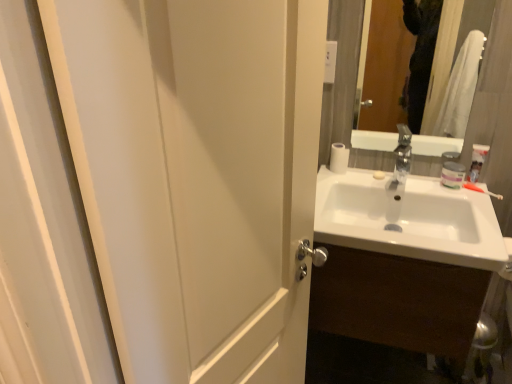
Where is `free space to the left of white matte jar at upper right`? This screenshot has height=384, width=512. free space to the left of white matte jar at upper right is located at coordinates (411, 178).